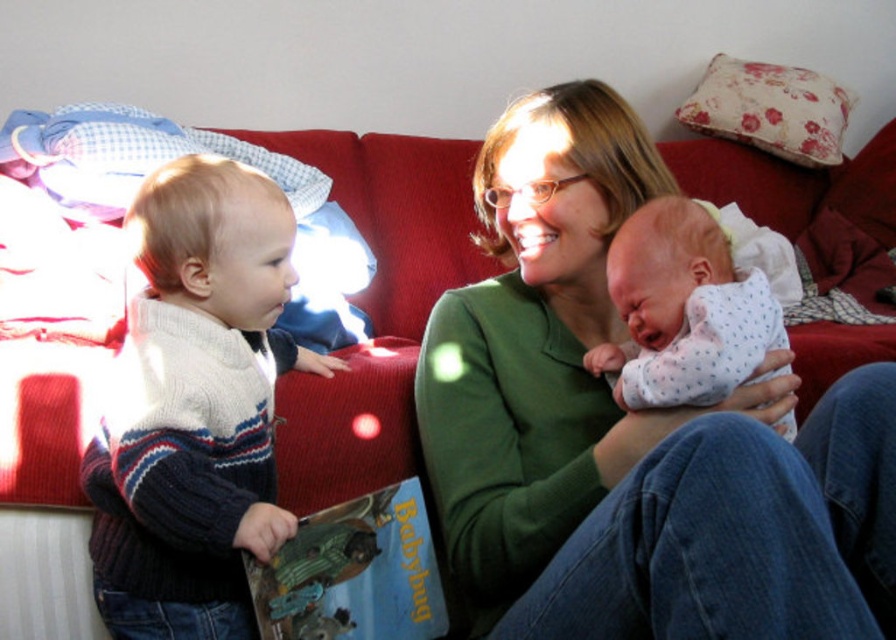
What is the location of the point with coordinates (683, 310) in the image?

The point with coordinates (683, 310) is located on the white dotted fabric at center.

You are standing in the living room looking at the sofa. There are two points marked on the sofa, one at coordinates point (179, 240) and the other at point (291, 545). Which of these two points is closer to you?

Point (179, 240) is closer to the viewer than point (291, 545).

You are a fashion designer observing the image. You notice the green soft sweater at center and the knitted sweater at left. Which one is positioned lower in the image?

The green soft sweater at center is positioned lower than the knitted sweater at left, as it is located below it.